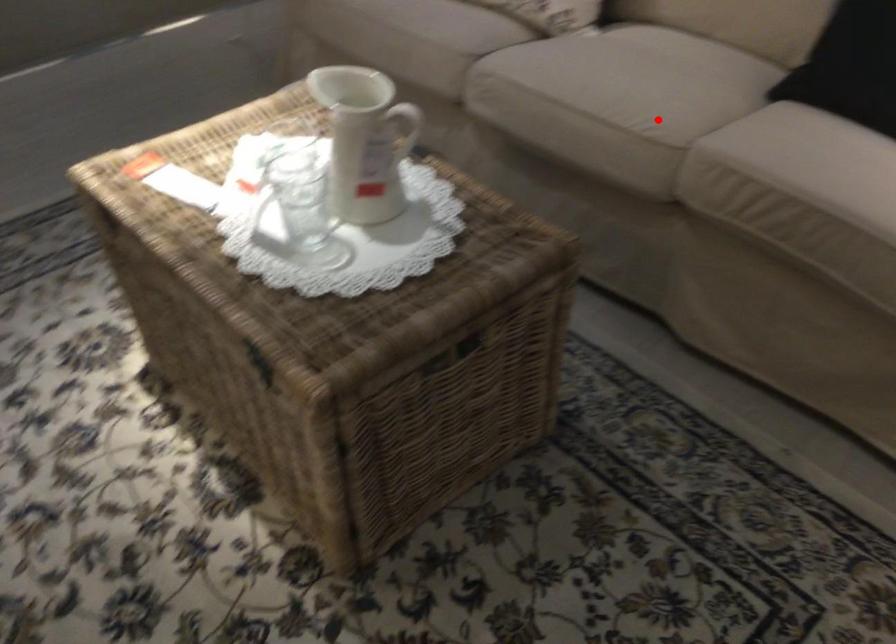
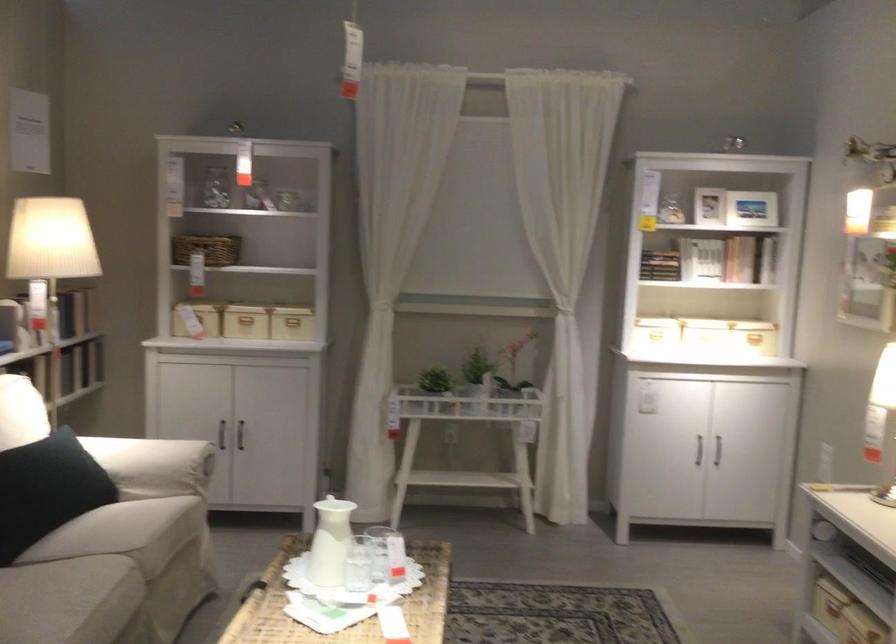
Question: I am providing you with two images of the same scene from different viewpoints. Image1 has a red point marked. In image2, the corresponding 3D location appears at what relative position? Reply with the corresponding letter.

Choices:
 (A) Closer
 (B) Farther

Answer: (B)